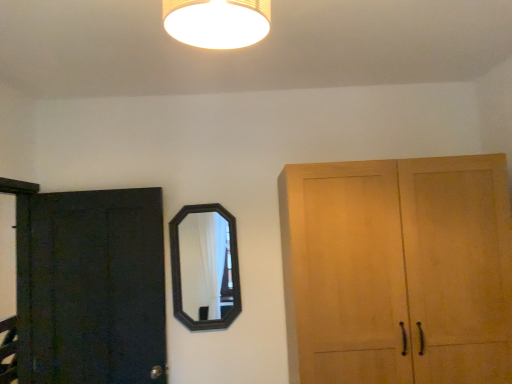
Question: Is matte yellow lampshade at upper center situated inside dark matte wood door at left or outside?

Choices:
 (A) outside
 (B) inside

Answer: (A)

Question: From the image's perspective, is matte yellow lampshade at upper center above or below dark matte wood door at left?

Choices:
 (A) below
 (B) above

Answer: (B)

Question: Considering the real-world distances, which object is closest to the matte yellow lampshade at upper center?

Choices:
 (A) dark matte wood door at left
 (B) black wooden mirror at center

Answer: (B)

Question: Based on their relative distances, which object is farther from the black wooden mirror at center?

Choices:
 (A) dark matte wood door at left
 (B) matte yellow lampshade at upper center

Answer: (B)